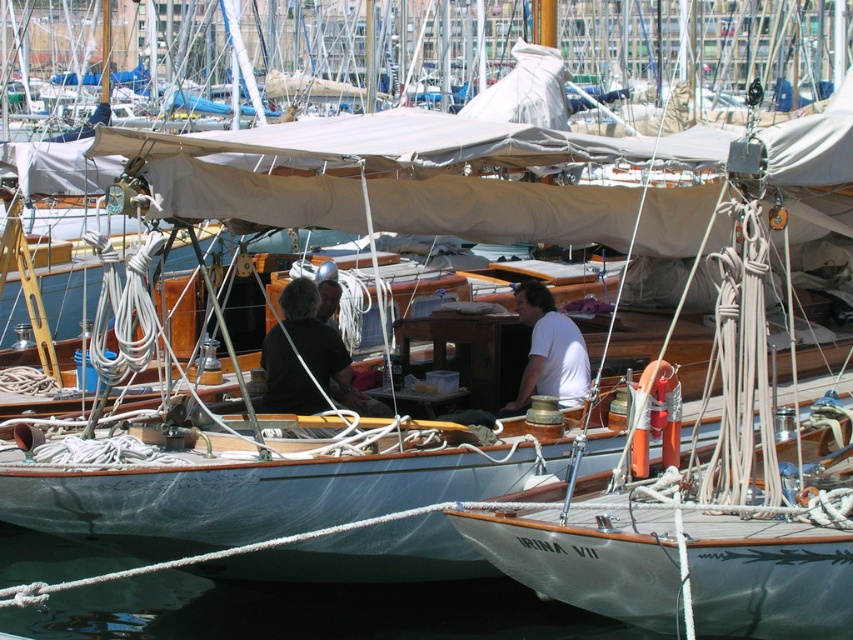
Question: Among these points, which one is farthest from the camera?

Choices:
 (A) (519, 410)
 (B) (546, 332)
 (C) (299, 592)

Answer: (A)

Question: Where is transparent water at lower left located in relation to dark brown leather couch at center in the image?

Choices:
 (A) below
 (B) above

Answer: (A)

Question: Which point appears closest to the camera in this image?

Choices:
 (A) (300, 282)
 (B) (219, 595)

Answer: (B)

Question: Is transparent water at lower left above dark brown leather couch at center?

Choices:
 (A) yes
 (B) no

Answer: (B)

Question: Is transparent water at lower left in front of dark brown leather couch at center?

Choices:
 (A) no
 (B) yes

Answer: (B)

Question: Which object is farther from the camera taking this photo?

Choices:
 (A) white matte shirt at center
 (B) dark brown leather couch at center
 (C) transparent water at lower left

Answer: (B)